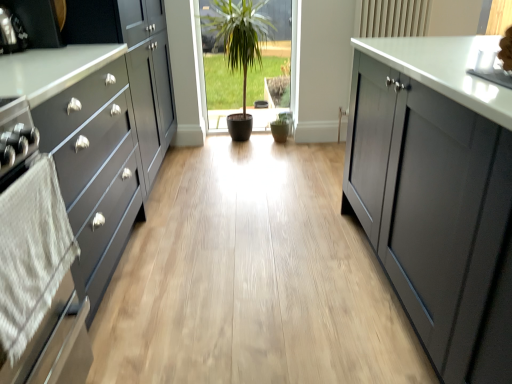
Question: Does matte black cabinet at left have a lesser height compared to white textured towel at left?

Choices:
 (A) yes
 (B) no

Answer: (B)

Question: From the image's perspective, is matte black cabinet at left located beneath white textured towel at left?

Choices:
 (A) yes
 (B) no

Answer: (B)

Question: Can you confirm if matte black cabinet at left is smaller than white textured towel at left?

Choices:
 (A) yes
 (B) no

Answer: (B)

Question: Is matte black cabinet at left at the left side of white textured towel at left?

Choices:
 (A) no
 (B) yes

Answer: (B)

Question: From a real-world perspective, is matte black cabinet at left on top of white textured towel at left?

Choices:
 (A) no
 (B) yes

Answer: (A)

Question: Is point (129, 182) positioned closer to the camera than point (67, 276)?

Choices:
 (A) farther
 (B) closer

Answer: (A)

Question: Which is correct: matte black cabinet at left is inside white textured towel at left, or outside of it?

Choices:
 (A) outside
 (B) inside

Answer: (A)

Question: From the image's perspective, is matte black cabinet at left positioned above or below white textured towel at left?

Choices:
 (A) above
 (B) below

Answer: (A)

Question: Looking at their shapes, would you say matte black cabinet at left is wider or thinner than white textured towel at left?

Choices:
 (A) thin
 (B) wide

Answer: (B)

Question: From their relative heights in the image, would you say matte black oven at left is taller or shorter than matte black cabinet at left?

Choices:
 (A) tall
 (B) short

Answer: (B)

Question: From a real-world perspective, is matte black oven at left physically located above or below matte black cabinet at left?

Choices:
 (A) below
 (B) above

Answer: (A)

Question: Considering the positions of matte black oven at left and matte black cabinet at left in the image, is matte black oven at left bigger or smaller than matte black cabinet at left?

Choices:
 (A) small
 (B) big

Answer: (A)

Question: Would you say matte black oven at left is inside or outside matte black cabinet at left?

Choices:
 (A) outside
 (B) inside

Answer: (A)

Question: Looking at their shapes, would you say white textured towel at left is wider or thinner than matte black oven at left?

Choices:
 (A) wide
 (B) thin

Answer: (B)

Question: Relative to matte black oven at left, is white textured towel at left in front or behind?

Choices:
 (A) front
 (B) behind

Answer: (A)